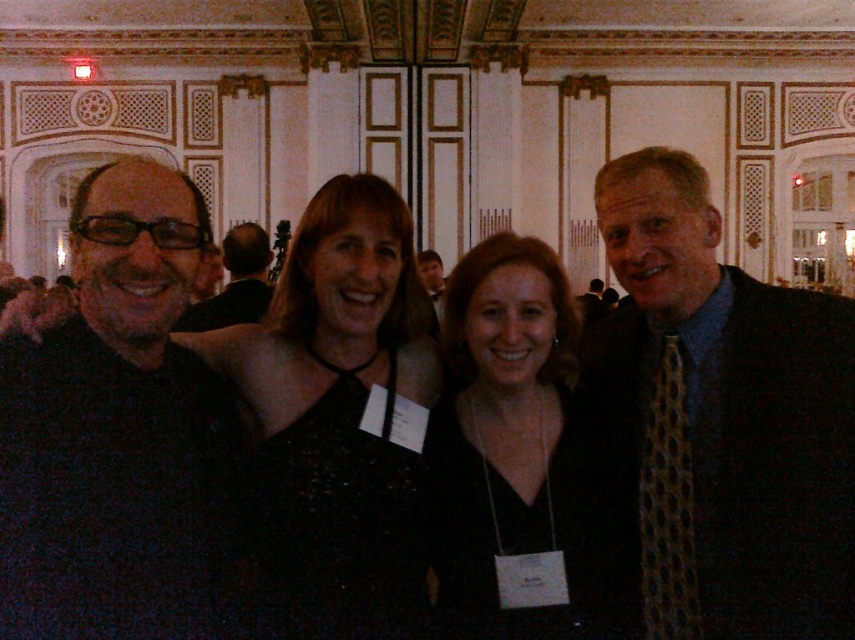
Based on the scene description, where exactly is the patterned silk tie at right located in the image?

The patterned silk tie at right is located at point (723, 419) in the image.

You are a photographer at the event and want to capture a photo of the patterned silk tie at right and the black fabric dress at center. Which object is located to the right of the other?

The patterned silk tie at right is positioned on the right side of black fabric dress at center, so the patterned silk tie at right is to the right of the black fabric dress at center.